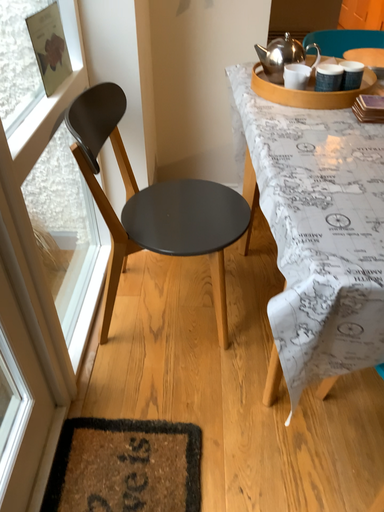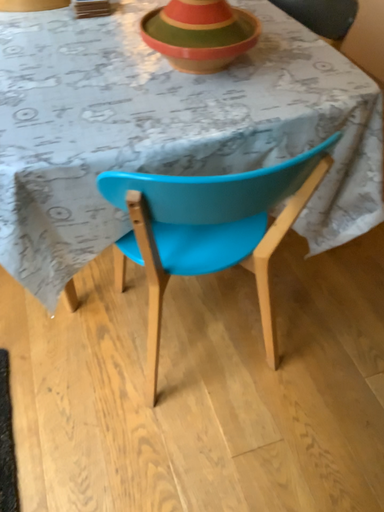
Question: How did the camera likely rotate when shooting the video?

Choices:
 (A) rotated left
 (B) rotated right

Answer: (B)